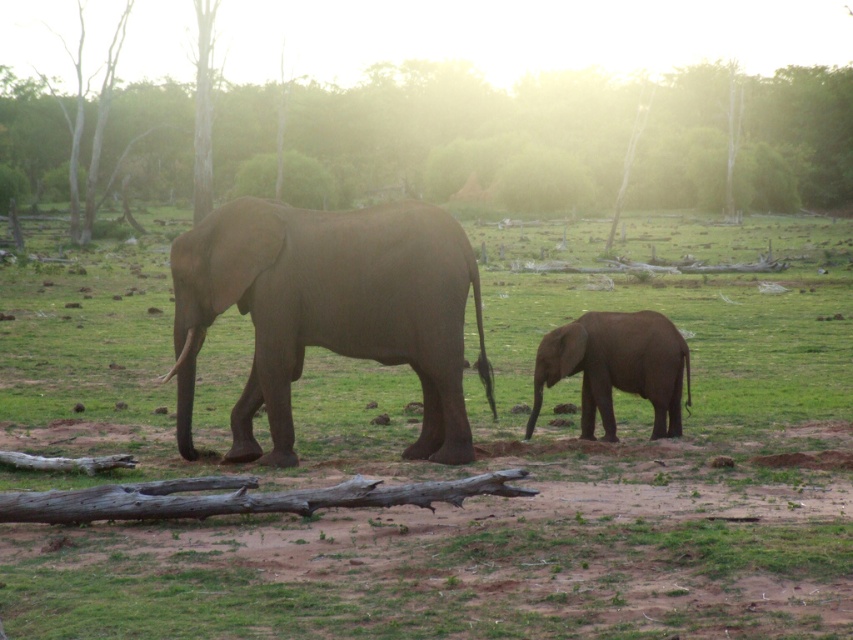
Question: Among these points, which one is nearest to the camera?

Choices:
 (A) (471, 346)
 (B) (457, 404)
 (C) (183, 42)

Answer: (B)

Question: In this image, where is brown matte elephant at center located relative to gray matte elephant at center?

Choices:
 (A) right
 (B) left

Answer: (B)

Question: Which object is the farthest from the gray matte elephant at lower right?

Choices:
 (A) gray matte elephant at center
 (B) brown textured tree at upper center

Answer: (B)

Question: Among these objects, which one is nearest to the camera?

Choices:
 (A) brown matte elephant at center
 (B) gray matte elephant at center
 (C) brown textured tree at upper center
 (D) gray matte elephant at lower right

Answer: (A)

Question: Can you confirm if brown matte elephant at center is wider than gray matte elephant at center?

Choices:
 (A) no
 (B) yes

Answer: (B)

Question: Does brown textured tree at upper center have a smaller size compared to gray matte elephant at center?

Choices:
 (A) no
 (B) yes

Answer: (A)